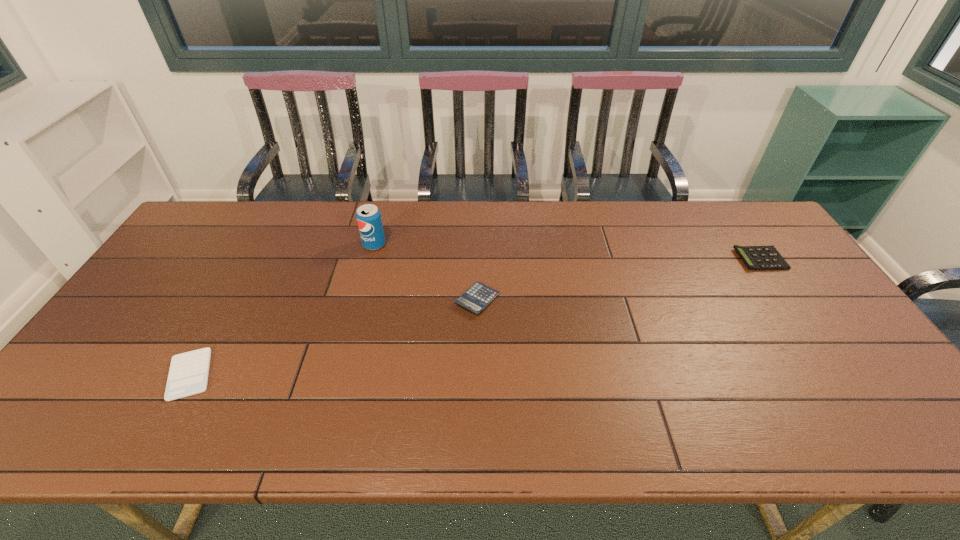
Identify the location of object that is the second closest one to the rightmost object. This screenshot has width=960, height=540. (368, 216).

You are a GUI agent. You are given a task and a screenshot of the screen. Output one action in this format:
    pyautogui.click(x=<x>, y=<y>)
    Task: Click on the closest calculator to the second nearest calculator
    
    Given the screenshot: What is the action you would take?
    pyautogui.click(x=188, y=375)

Identify which calculator is the third closest to the third object from right to left. Please provide its 2D coordinates. Your answer should be formatted as a tuple, i.e. [(x, y)], where the tuple contains the x and y coordinates of a point satisfying the conditions above.

[(759, 258)]

I want to click on free point that satisfies the following two spatial constraints: 1. on the back side of the leftmost calculator; 2. on the left side of the second farthest calculator, so click(231, 300).

Find the location of a particular element. This screenshot has height=540, width=960. vacant region that satisfies the following two spatial constraints: 1. on the back side of the second nearest calculator; 2. on the left side of the leftmost calculator is located at coordinates (231, 300).

What are the coordinates of `free space that satisfies the following two spatial constraints: 1. on the back side of the shortest calculator; 2. on the right side of the second calculator from left to right` in the screenshot? It's located at (231, 300).